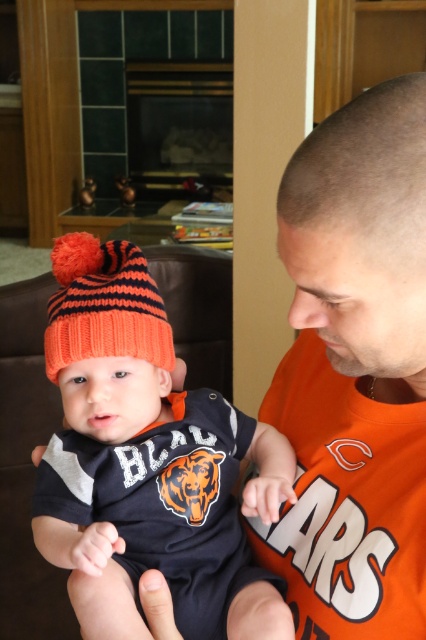
Question: Is knitted wool beanie at center-left bigger than orange jersey at center?

Choices:
 (A) no
 (B) yes

Answer: (B)

Question: Which point is closer to the camera?

Choices:
 (A) (101, 608)
 (B) (92, 285)
 (C) (382, 618)

Answer: (C)

Question: Does orange jersey at center have a smaller size compared to orange knitted beanie at center?

Choices:
 (A) yes
 (B) no

Answer: (B)

Question: Estimate the real-world distances between objects in this image. Which object is closer to the orange knitted beanie at center?

Choices:
 (A) orange jersey at center
 (B) knitted wool beanie at center-left

Answer: (B)

Question: Does orange jersey at center appear under orange knitted beanie at center?

Choices:
 (A) no
 (B) yes

Answer: (B)

Question: Which is nearer to the knitted wool beanie at center-left?

Choices:
 (A) orange jersey at center
 (B) orange knitted beanie at center

Answer: (B)